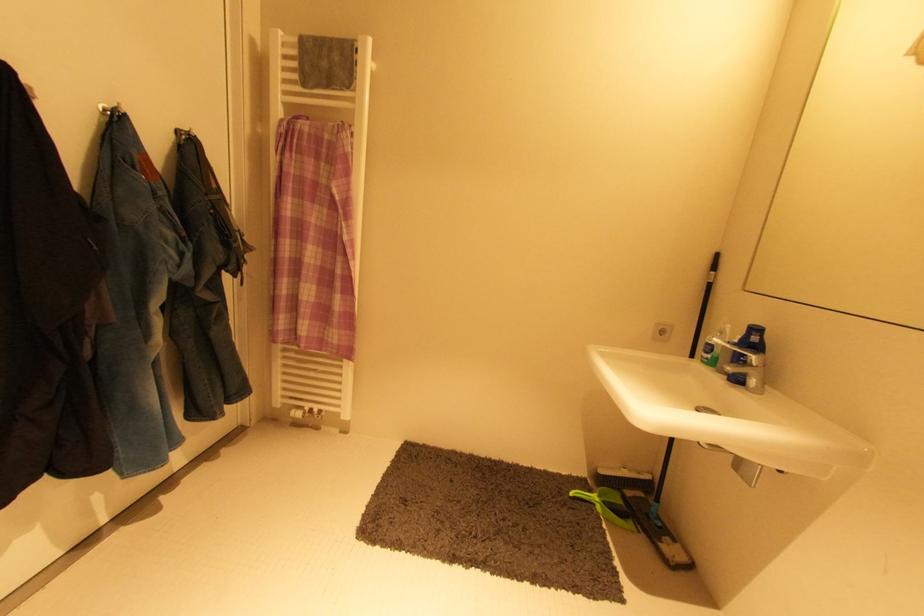
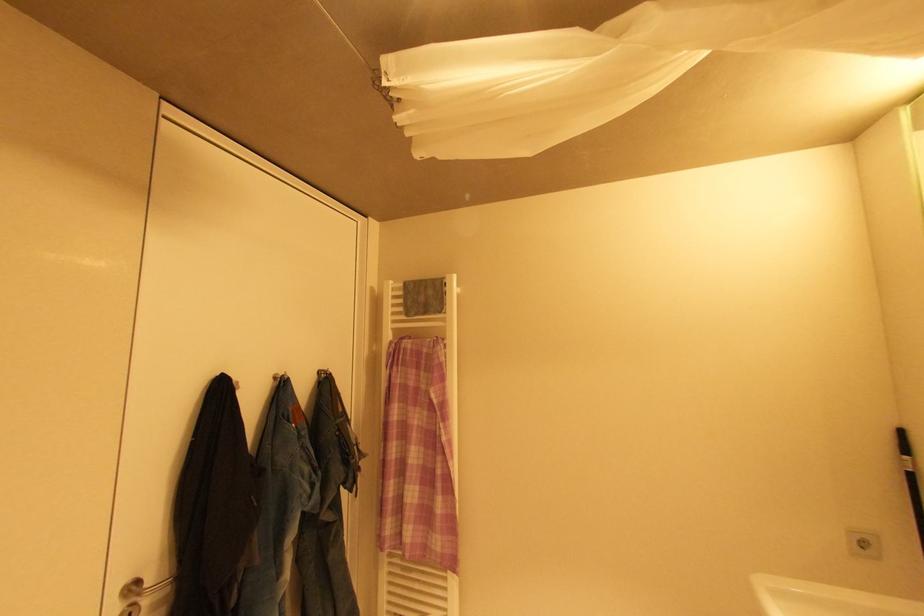
The images are taken continuously from a first-person perspective. In which direction are you moving?

The cameraman moved toward right, backward.